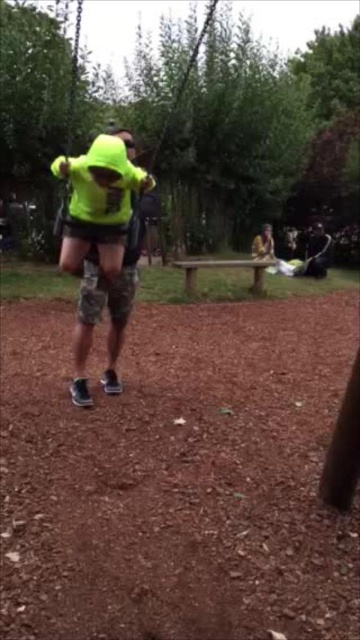
Which is more to the left, neon yellow hoodie at center or matte black backpack at center?

Positioned to the left is neon yellow hoodie at center.

Is point (101, 189) farther from viewer compared to point (254, 252)?

That is False.

Where is `neon yellow hoodie at center`? Image resolution: width=360 pixels, height=640 pixels. neon yellow hoodie at center is located at coordinates click(x=102, y=244).

Can you confirm if brown wooden bench at center is thinner than matte black backpack at center?

Incorrect, brown wooden bench at center's width is not less than matte black backpack at center's.

Is brown wooden bench at center bigger than matte black backpack at center?

Correct, brown wooden bench at center is larger in size than matte black backpack at center.

Between point (199, 266) and point (258, 234), which one is positioned behind?

The point (258, 234) is behind.

What are the coordinates of `brown wooden bench at center` in the screenshot? It's located at (222, 268).

Does point (198, 346) come behind point (187, 266)?

That is False.

Which is in front, point (246, 417) or point (186, 269)?

Positioned in front is point (246, 417).

Find the location of a particular element. brown mulch at center is located at coordinates (177, 476).